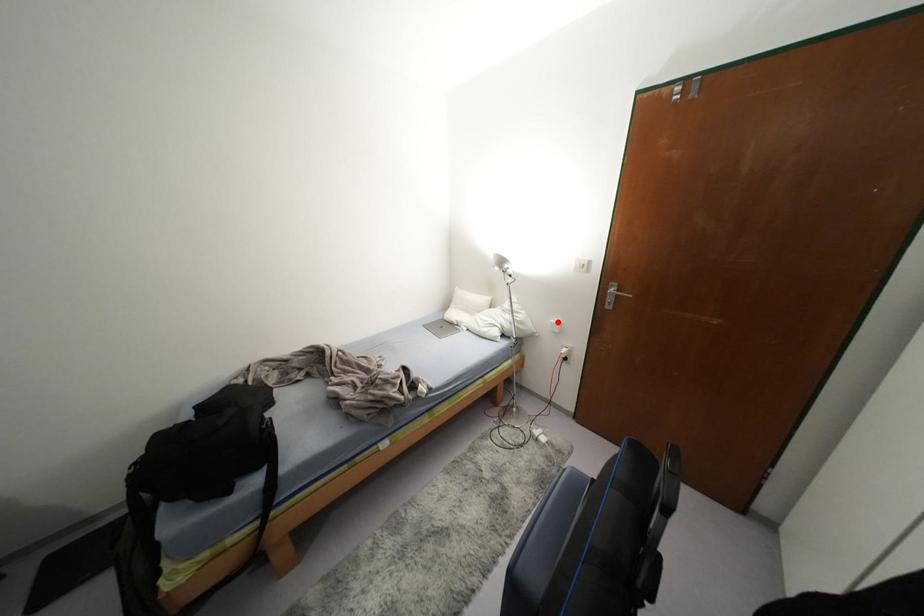
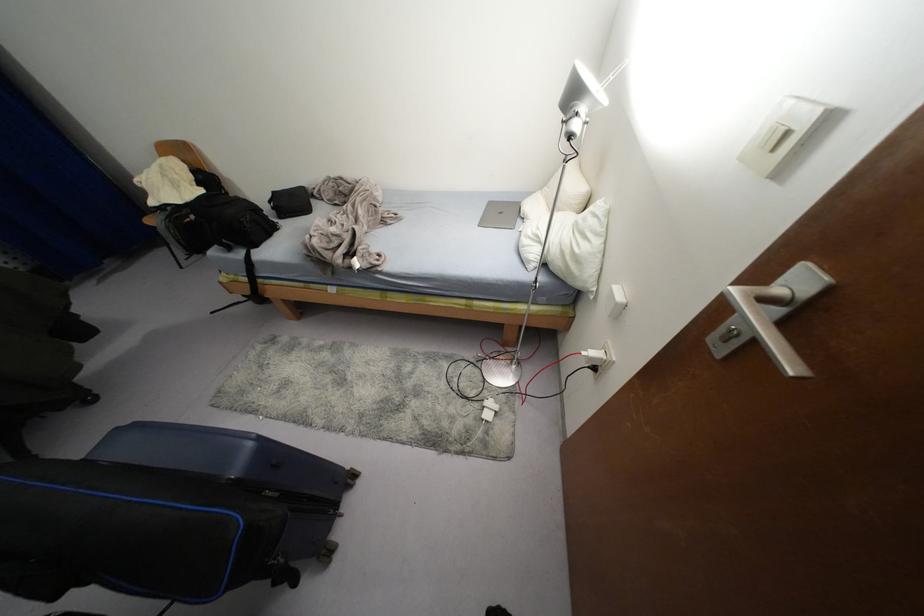
Where in the second image is the point corresponding to the highlighted location from the first image?

(619, 299)